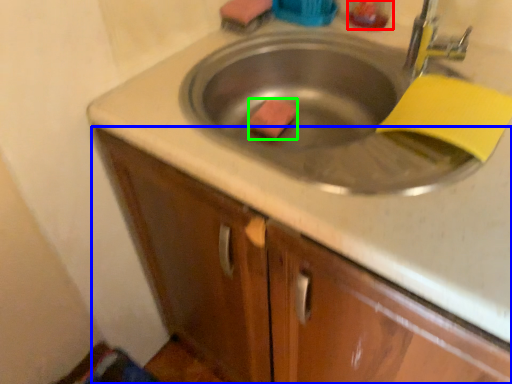
Question: Which object is the closest to the liquid (highlighted by a red box)? Choose among these: cabinetry (highlighted by a blue box) or soap (highlighted by a green box).

Choices:
 (A) cabinetry
 (B) soap

Answer: (B)